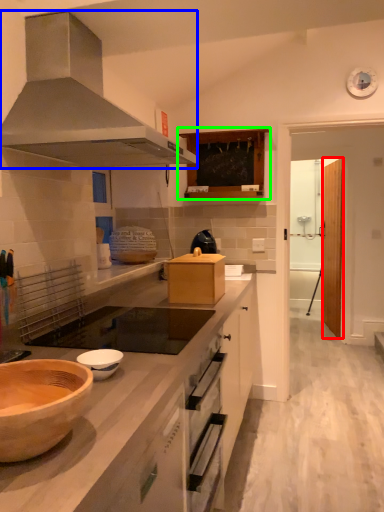
Question: Which is nearer to the glass door (highlighted by a red box)? kitchen appliance (highlighted by a blue box) or cabinetry (highlighted by a green box).

Choices:
 (A) kitchen appliance
 (B) cabinetry

Answer: (B)